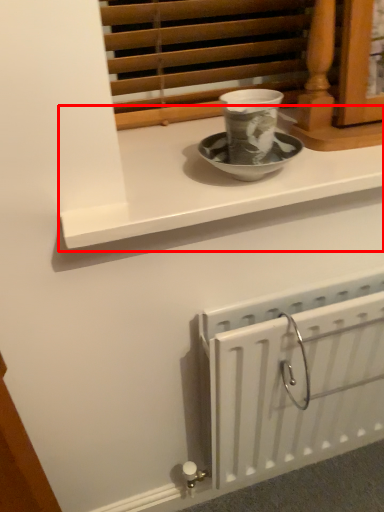
Question: From the image's perspective, what is the correct spatial positioning of window sill (annotated by the red box) in reference to radiator?

Choices:
 (A) above
 (B) below

Answer: (A)